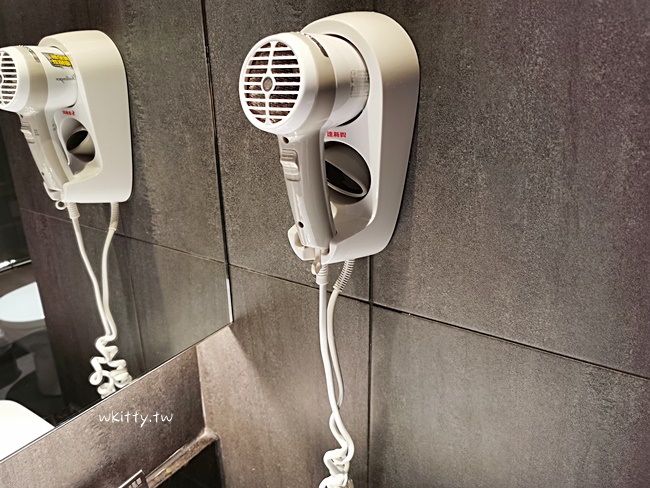
The image size is (650, 488). In order to click on hair dyer holder in this screenshot , I will do `click(382, 114)`.